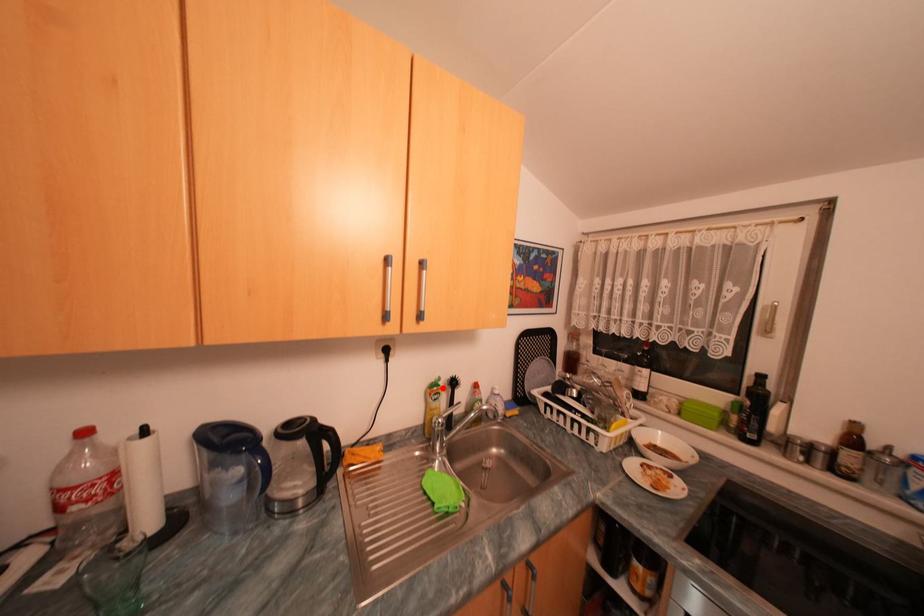
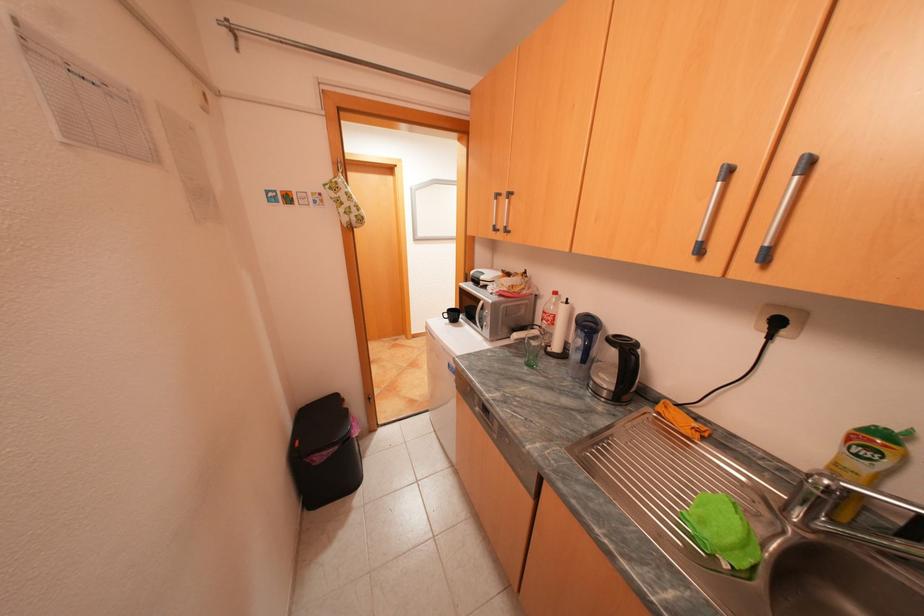
Find the pixel in the second image that matches the highlighted location in the first image.

(882, 439)